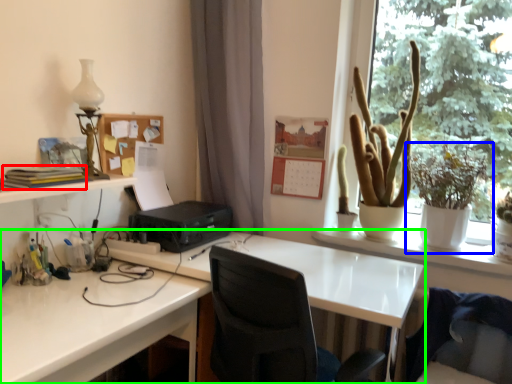
Question: Which is nearer to the book (highlighted by a red box)? houseplant (highlighted by a blue box) or desk (highlighted by a green box).

Choices:
 (A) houseplant
 (B) desk

Answer: (B)